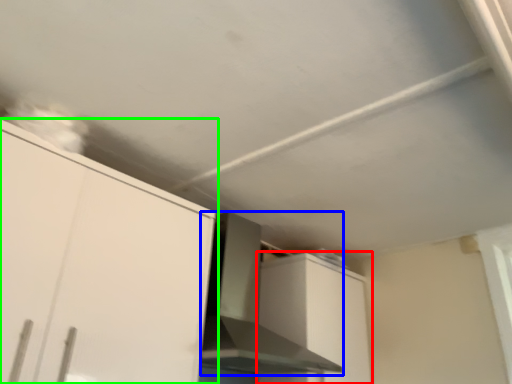
Question: Considering the real-world distances, which object is farthest from cabinetry (highlighted by a red box)? vent (highlighted by a blue box) or cabinetry (highlighted by a green box)?

Choices:
 (A) vent
 (B) cabinetry

Answer: (B)